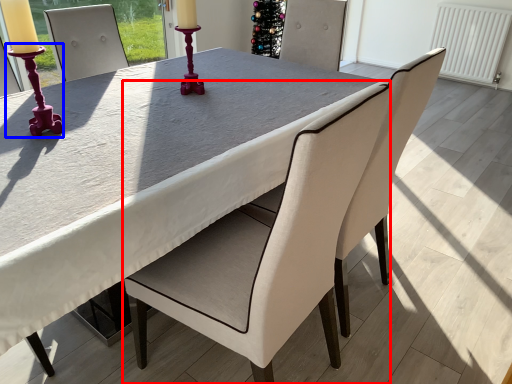
Question: Among these objects, which one is farthest to the camera, chair (highlighted by a red box) or candle holder (highlighted by a blue box)?

Choices:
 (A) chair
 (B) candle holder

Answer: (B)